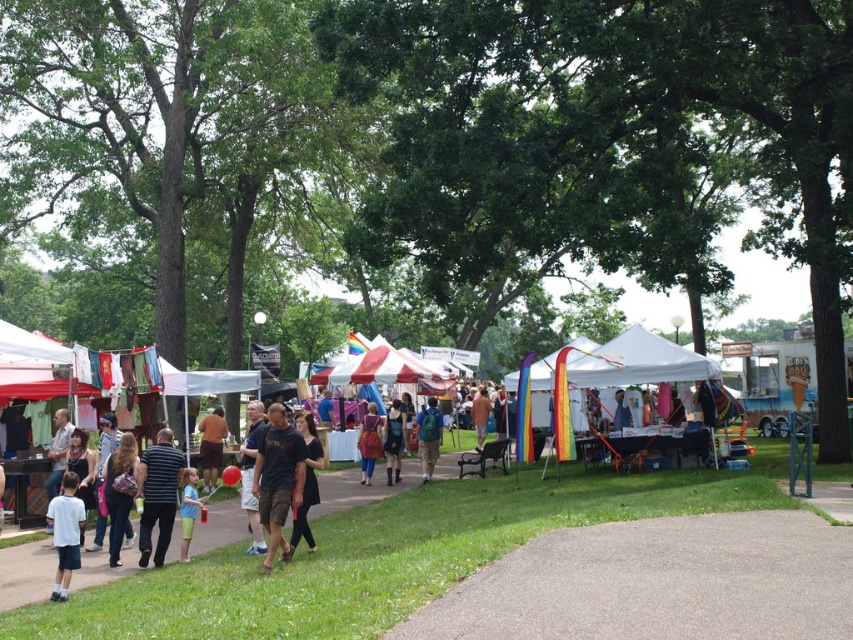
Question: Is white fabric tents at center above dark gray shirt at center?

Choices:
 (A) no
 (B) yes

Answer: (A)

Question: Which object appears farthest from the camera in this image?

Choices:
 (A) denim jeans at lower left
 (B) dark gray shirt at center

Answer: (A)

Question: Is white fabric tents at center wider than multicolored fabric dress at center?

Choices:
 (A) yes
 (B) no

Answer: (A)

Question: Does gray concrete path at center appear on the left side of striped cotton shirt at lower left?

Choices:
 (A) yes
 (B) no

Answer: (B)

Question: Which object appears farthest from the camera in this image?

Choices:
 (A) brown cotton shirt at center
 (B) dark gray shirt at center

Answer: (A)

Question: Which point appears closest to the camera in this image?

Choices:
 (A) 177,460
 (B) 256,420
 (C) 474,412

Answer: (A)